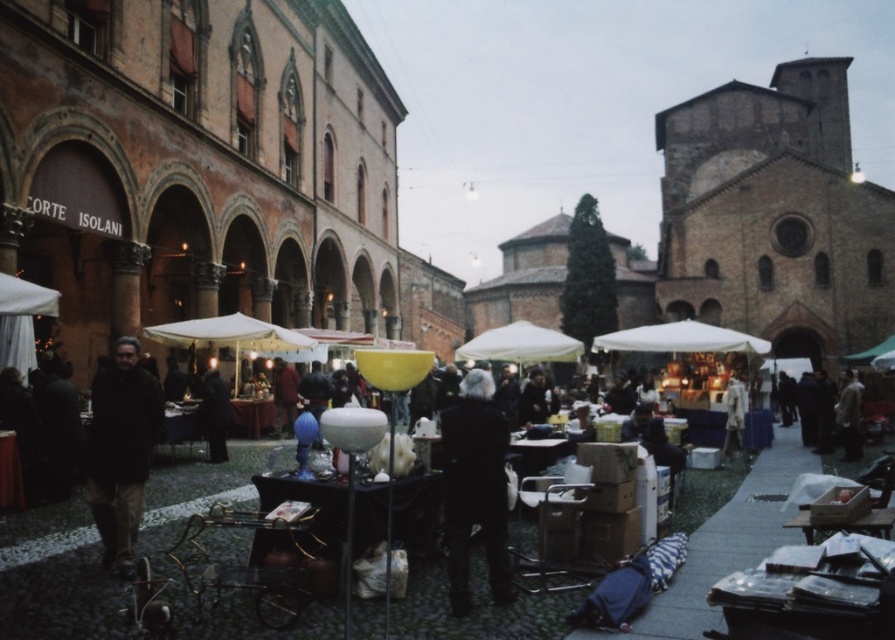
You are a customer at the market and need to decide between the black wool coat at center and the dark brown leather jacket at left. Which one is wider?

The dark brown leather jacket at left is wider than the black wool coat at center.

You are a customer at the market and want to buy a black wool coat at center. The vendor is standing at point (475, 488). Can you find the vendor for the black wool coat at center?

Yes, the vendor is standing at point (475, 488), which is on the black wool coat at center, so you can find the vendor there.

What are the coordinates of the black wool coat at center?

The coordinates of the black wool coat at center are 0.764 in the x direction and 0.532 in the y direction.